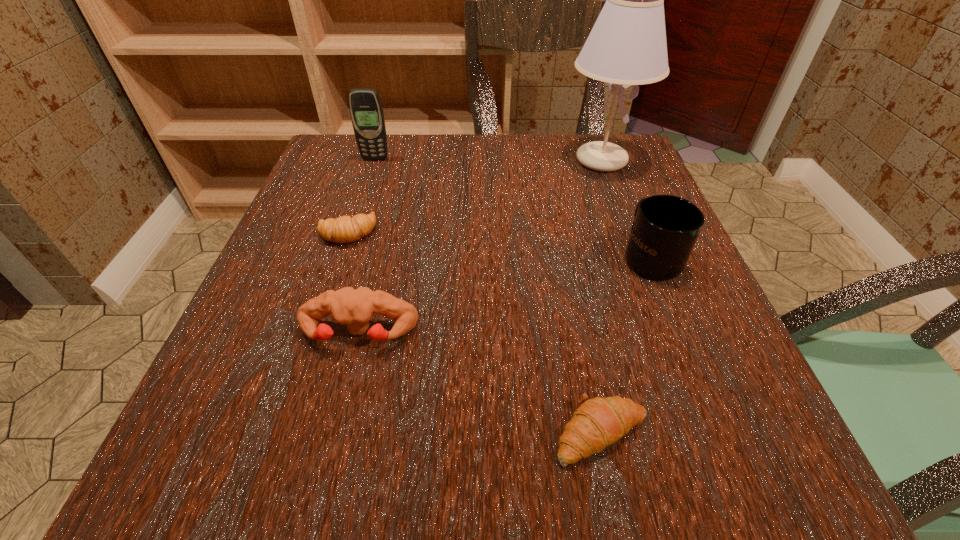
At what (x,y) coordinates should I click in order to perform the action: click on lampshade. Please return your answer as a coordinate pair (x, y). This screenshot has width=960, height=540. Looking at the image, I should click on (627, 45).

Locate an element on the screen. The width and height of the screenshot is (960, 540). the fifth shortest object is located at coordinates (366, 111).

You are a GUI agent. You are given a task and a screenshot of the screen. Output one action in this format:
    pyautogui.click(x=<x>, y=<y>)
    Task: Click on the fourth shortest object
    The height and width of the screenshot is (540, 960).
    Given the screenshot: What is the action you would take?
    pyautogui.click(x=665, y=229)

In order to click on the third shortest object in this screenshot , I will do (354, 308).

I want to click on the fifth farthest object, so click(354, 308).

Identify the location of the left crescent roll. (344, 229).

Where is `the right crescent roll`? the right crescent roll is located at coordinates (599, 422).

The height and width of the screenshot is (540, 960). In order to click on the nearest object in this screenshot , I will do `click(599, 422)`.

Locate an element on the screen. The image size is (960, 540). vacant area located 0.050m on the left of the lampshade is located at coordinates (540, 160).

Where is `vacant space situated on the screen of the fifth shortest object`? The width and height of the screenshot is (960, 540). vacant space situated on the screen of the fifth shortest object is located at coordinates (340, 268).